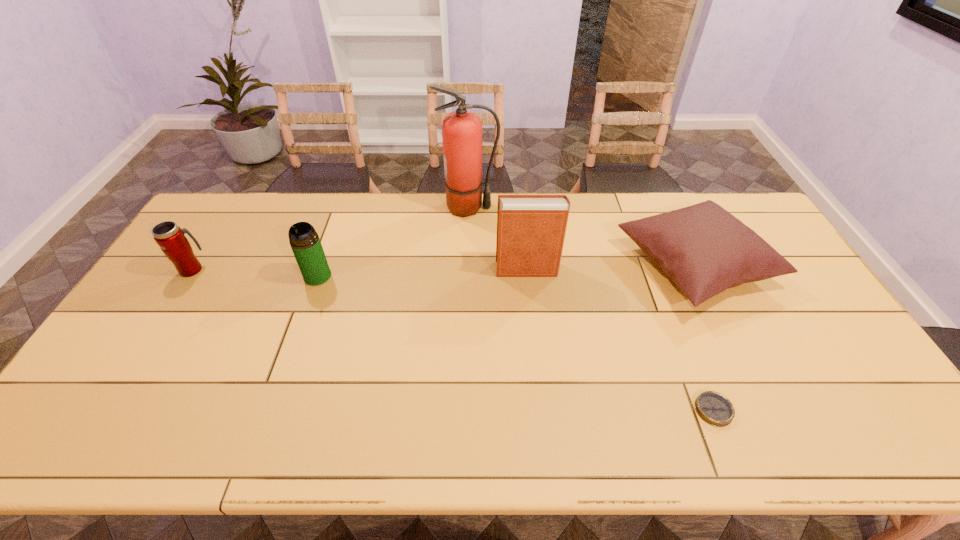
You are a GUI agent. You are given a task and a screenshot of the screen. Output one action in this format:
    pyautogui.click(x=<x>, y=<y>)
    Task: Click on the cushion present at the far edge
    
    Given the screenshot: What is the action you would take?
    pyautogui.click(x=704, y=249)

The height and width of the screenshot is (540, 960). Find the location of `object located in the near edge section of the desktop`. object located in the near edge section of the desktop is located at coordinates (714, 408).

This screenshot has height=540, width=960. I want to click on object that is at the left edge, so (170, 237).

You are a GUI agent. You are given a task and a screenshot of the screen. Output one action in this format:
    pyautogui.click(x=<x>, y=<y>)
    Task: Click on the object located at the right edge
    
    Given the screenshot: What is the action you would take?
    pyautogui.click(x=704, y=249)

Where is `object at the far right corner`? object at the far right corner is located at coordinates (704, 249).

Find the location of a particular element. The height and width of the screenshot is (540, 960). free space at the far edge of the desktop is located at coordinates (340, 224).

I want to click on vacant space at the near edge of the desktop, so click(201, 420).

The width and height of the screenshot is (960, 540). What are the coordinates of `free location at the right edge of the desktop` in the screenshot? It's located at (757, 285).

The width and height of the screenshot is (960, 540). In the image, there is a desktop. Identify the location of free space at the far left corner. (207, 230).

At what (x,y) coordinates should I click in order to perform the action: click on vacant area that lies between the second object from left to right and the fire extinguisher. Please return your answer as a coordinate pair (x, y). The height and width of the screenshot is (540, 960). Looking at the image, I should click on (393, 242).